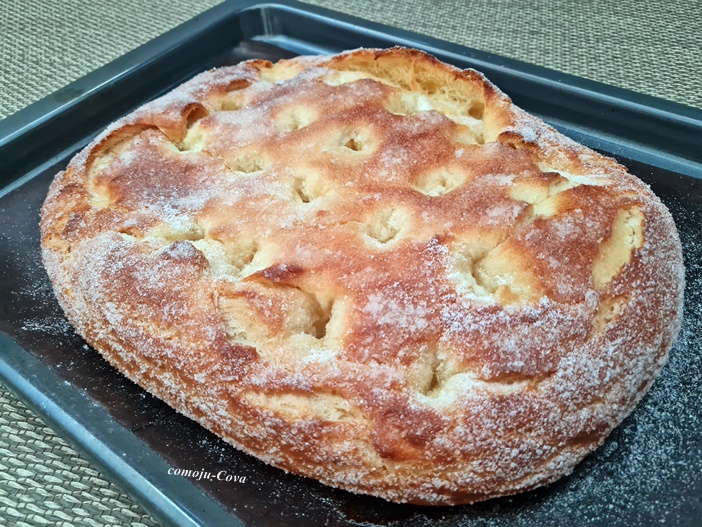
At what (x,y) coordinates should I click in order to perform the action: click on flour on metal oven pan. Please return your answer as a coordinate pair (x, y). The image size is (702, 527). Looking at the image, I should click on (647, 432), (46, 321).